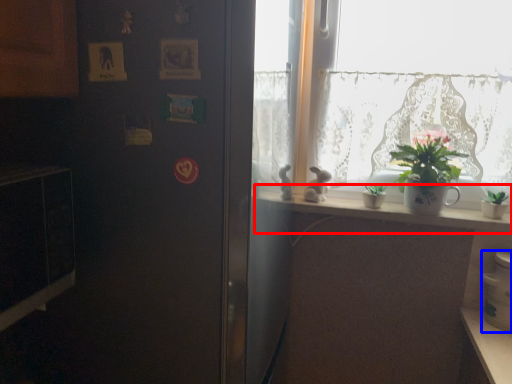
Question: Which object appears closest to the camera in this image, window sill (highlighted by a red box) or appliance (highlighted by a blue box)?

Choices:
 (A) window sill
 (B) appliance

Answer: (B)